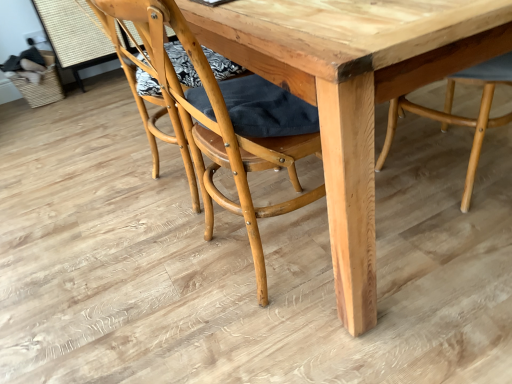
Question: Relative to natural wood chair at center, which is counted as the first chair, starting from the right, is natural wood table at center in front or behind?

Choices:
 (A) behind
 (B) front

Answer: (B)

Question: Visually, is natural wood table at center positioned to the left or to the right of natural wood chair at center, which is counted as the first chair, starting from the right?

Choices:
 (A) left
 (B) right

Answer: (A)

Question: Estimate the real-world distances between objects in this image. Which object is farther from the natural wood chair at center, the 2th chair in the left-to-right sequence?

Choices:
 (A) natural wood table at center
 (B) natural wood chair at center, positioned as the 2th chair in right-to-left order

Answer: (B)

Question: Which object is positioned farthest from the natural wood chair at center, positioned as the 2th chair in right-to-left order?

Choices:
 (A) natural wood chair at center, which is counted as the first chair, starting from the right
 (B) natural wood table at center

Answer: (A)